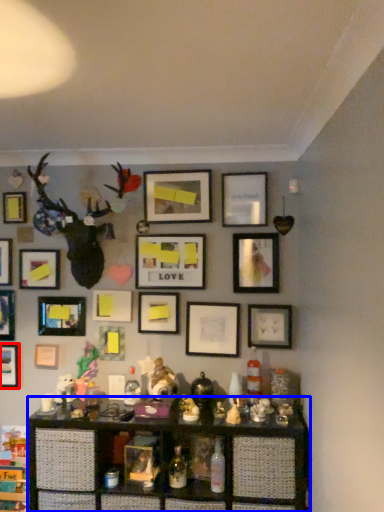
Question: Among these objects, which one is nearest to the camera, picture frame (highlighted by a red box) or shelf (highlighted by a blue box)?

Choices:
 (A) picture frame
 (B) shelf

Answer: (B)